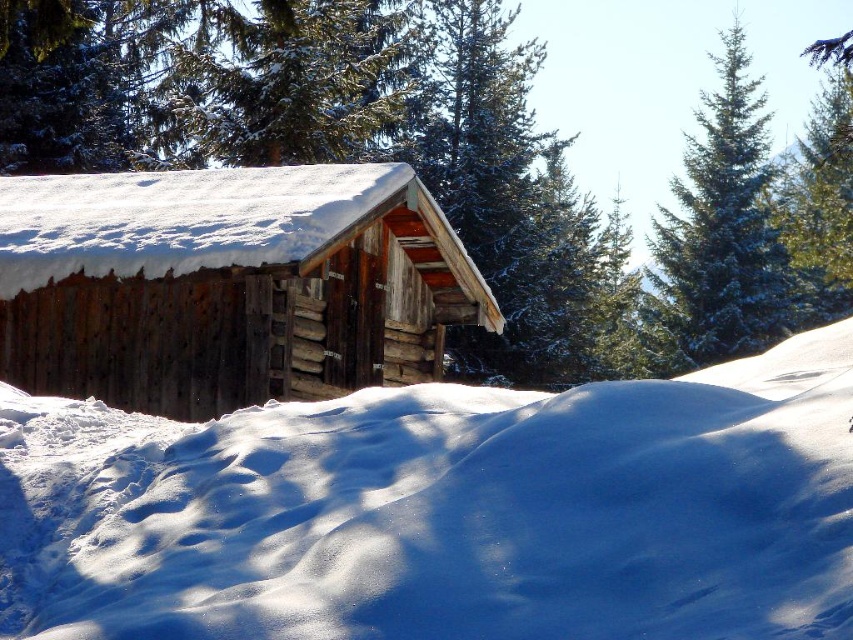
Question: Which of the following is the closest to the observer?

Choices:
 (A) (61, 365)
 (B) (654, 275)

Answer: (A)

Question: Which of the following is the farthest from the observer?

Choices:
 (A) (747, 208)
 (B) (0, 230)
 (C) (701, 300)

Answer: (A)

Question: Does green textured pine tree at upper center have a greater width compared to green needle-like at upper right?

Choices:
 (A) no
 (B) yes

Answer: (B)

Question: Which object is the farthest from the green needle-like at upper right?

Choices:
 (A) white fluffy snow at center
 (B) green textured pine tree at upper center

Answer: (A)

Question: Does green textured pine tree at upper center have a greater width compared to rustic wood log cabin at center?

Choices:
 (A) yes
 (B) no

Answer: (A)

Question: Can you confirm if green textured pine tree at upper center is positioned above green needle-like at upper right?

Choices:
 (A) yes
 (B) no

Answer: (A)